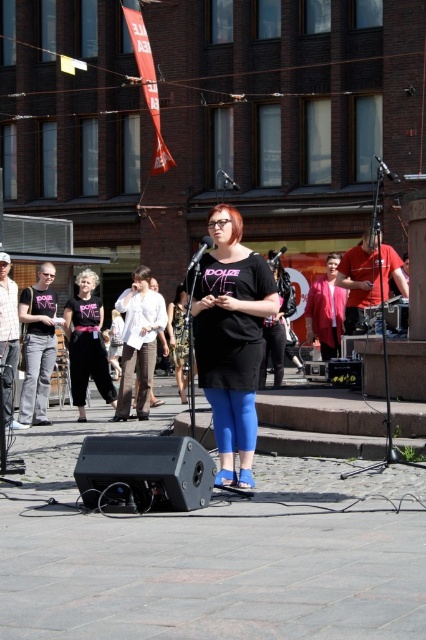
You are a photographer trying to capture the performer wearing the matte black pants at center. Where should you position your camera to ensure the pants are in the center of the photo?

Position the camera at point (86, 342) to center the matte black pants at center in the photo.

You are a photographer setting up for a street performance. You need to decide whether to place a light source closer to the matte black pants at left or the metallic silver microphone at center. Based on their heights, which object should the light be positioned closer to?

The matte black pants at left has a greater height compared to the metallic silver microphone at center, so the light should be placed closer to the matte black pants at left to ensure proper illumination.

You are a street performer setting up your equipment. You have a matte black pants at left and a metallic silver microphone at center. Which object is narrower?

The matte black pants at left is narrower than the metallic silver microphone at center.